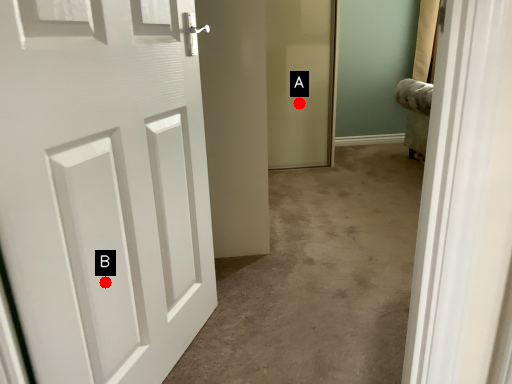
Question: Two points are circled on the image, labeled by A and B beside each circle. Which point is closer to the camera?

Choices:
 (A) A is closer
 (B) B is closer

Answer: (B)